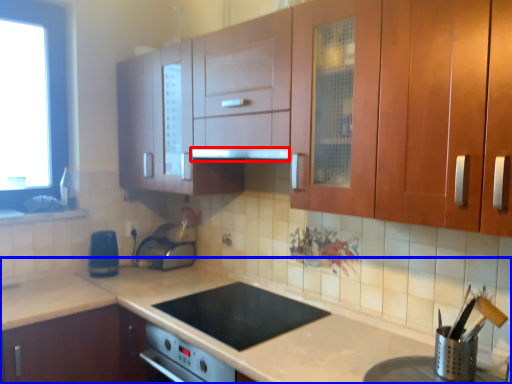
Question: Which object appears closest to the camera in this image, exhaust hood (highlighted by a red box) or countertop (highlighted by a blue box)?

Choices:
 (A) exhaust hood
 (B) countertop

Answer: (B)